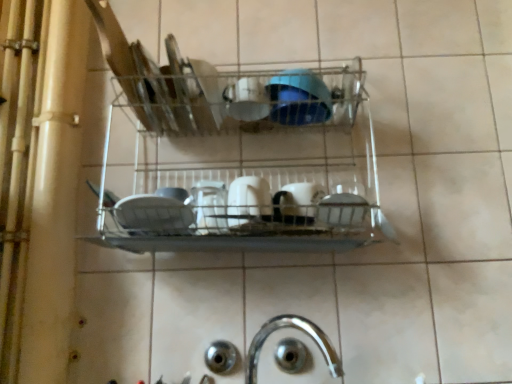
The width and height of the screenshot is (512, 384). Describe the element at coordinates (298, 329) in the screenshot. I see `silver metallic tap at lower center` at that location.

This screenshot has height=384, width=512. In order to click on white glossy mug at center, the fourth tableware positioned from the top in this screenshot , I will do `click(297, 203)`.

You are a GUI agent. You are given a task and a screenshot of the screen. Output one action in this format:
    pyautogui.click(x=<x>, y=<y>)
    Task: Click on the white glossy mug at center, arranged as the 2th tableware when ordered from the bottom
    The image size is (512, 384).
    Given the screenshot: What is the action you would take?
    pyautogui.click(x=248, y=201)

This screenshot has height=384, width=512. Identify the location of white glossy cup at upper center, which is the second tableware from top to bottom. (246, 100).

The image size is (512, 384). Find the location of `silver metallic tap at lower center`. silver metallic tap at lower center is located at coordinates (298, 329).

From the image's perspective, starting from the silver metallic tap at lower center, which tableware is the 2nd one above? Please provide its 2D coordinates.

[(248, 201)]

Is white glossy mug at center, placed as the third tableware when sorted from top to bottom, taller than silver metallic tap at lower center?

In fact, white glossy mug at center, placed as the third tableware when sorted from top to bottom, may be shorter than silver metallic tap at lower center.

Between white glossy mug at center, placed as the third tableware when sorted from top to bottom, and silver metallic tap at lower center, which one has larger size?

silver metallic tap at lower center is bigger.

In the scene shown: Are white glossy mug at center, arranged as the 2th tableware when ordered from the bottom, and silver metallic tap at lower center located far from each other?

That's not correct — white glossy mug at center, arranged as the 2th tableware when ordered from the bottom, is a little close to silver metallic tap at lower center.

From the image's perspective, is white glossy mug at center, arranged as the 2th tableware when ordered from the bottom, beneath blue glossy bowl at center, the first tableware when ordered from top to bottom?

Yes, from the image's perspective, white glossy mug at center, arranged as the 2th tableware when ordered from the bottom, is beneath blue glossy bowl at center, the first tableware when ordered from top to bottom.

From a real-world perspective, is white glossy mug at center, placed as the third tableware when sorted from top to bottom, physically located above or below blue glossy bowl at center, the first tableware when ordered from top to bottom?

white glossy mug at center, placed as the third tableware when sorted from top to bottom, is below blue glossy bowl at center, the first tableware when ordered from top to bottom.

Considering the positions of objects white glossy mug at center, placed as the third tableware when sorted from top to bottom, and blue glossy bowl at center, which appears as the fourth tableware when ordered from the bottom, in the image provided, who is behind, white glossy mug at center, placed as the third tableware when sorted from top to bottom, or blue glossy bowl at center, which appears as the fourth tableware when ordered from the bottom,?

blue glossy bowl at center, which appears as the fourth tableware when ordered from the bottom, is further from the camera.

Measure the distance from white glossy mug at center, arranged as the 2th tableware when ordered from the bottom, to blue glossy bowl at center, which appears as the fourth tableware when ordered from the bottom.

white glossy mug at center, arranged as the 2th tableware when ordered from the bottom, is 8.41 inches away from blue glossy bowl at center, which appears as the fourth tableware when ordered from the bottom.

Is silver metallic tap at lower center next to white glossy mug at center, placed as the third tableware when sorted from top to bottom?

They are not placed beside each other.

Based on the photo, from a real-world perspective, which is physically below, silver metallic tap at lower center or white glossy mug at center, placed as the third tableware when sorted from top to bottom?

silver metallic tap at lower center.

From the image's perspective, is silver metallic tap at lower center above or below white glossy mug at center, placed as the third tableware when sorted from top to bottom?

From the image's perspective, silver metallic tap at lower center appears below white glossy mug at center, placed as the third tableware when sorted from top to bottom.

Is the depth of silver metallic tap at lower center less than that of white glossy mug at center, placed as the third tableware when sorted from top to bottom?

Yes, silver metallic tap at lower center is closer to the camera.

Can you tell me how much blue glossy bowl at center, the first tableware when ordered from top to bottom, and white glossy mug at center, arranged as the 2th tableware when ordered from the bottom, differ in facing direction?

There is a 7.02-degree angle between the facing directions of blue glossy bowl at center, the first tableware when ordered from top to bottom, and white glossy mug at center, arranged as the 2th tableware when ordered from the bottom.

Who is bigger, blue glossy bowl at center, which appears as the fourth tableware when ordered from the bottom, or white glossy mug at center, placed as the third tableware when sorted from top to bottom?

With larger size is blue glossy bowl at center, which appears as the fourth tableware when ordered from the bottom.

Considering the positions of point (302, 79) and point (234, 215), is point (302, 79) closer or farther from the camera than point (234, 215)?

Point (302, 79) appears to be farther away from the viewer than point (234, 215).

How much distance is there between blue glossy bowl at center, the first tableware when ordered from top to bottom, and white glossy mug at center, arranged as the 2th tableware when ordered from the bottom?

8.41 inches.

Do you think white glossy cup at upper center, which is the second tableware from top to bottom, is within white glossy mug at center, arranged as the 2th tableware when ordered from the bottom, or outside of it?

white glossy cup at upper center, which is the second tableware from top to bottom, cannot be found inside white glossy mug at center, arranged as the 2th tableware when ordered from the bottom.

Can you confirm if white glossy cup at upper center, which is the second tableware from top to bottom, is thinner than white glossy mug at center, arranged as the 2th tableware when ordered from the bottom?

Yes, white glossy cup at upper center, which is the second tableware from top to bottom, is thinner than white glossy mug at center, arranged as the 2th tableware when ordered from the bottom.

Measure the distance from white glossy cup at upper center, acting as the third tableware starting from the bottom, to white glossy mug at center, arranged as the 2th tableware when ordered from the bottom.

They are 7.87 inches apart.

In the image, is blue glossy bowl at center, which appears as the fourth tableware when ordered from the bottom, on the left side or the right side of white glossy mug at center, the 1th tableware positioned from the bottom?

blue glossy bowl at center, which appears as the fourth tableware when ordered from the bottom, is to the right of white glossy mug at center, the 1th tableware positioned from the bottom.

From a real-world perspective, between blue glossy bowl at center, which appears as the fourth tableware when ordered from the bottom, and white glossy mug at center, the fourth tableware positioned from the top, who is vertically lower?

From a 3D spatial view, white glossy mug at center, the fourth tableware positioned from the top, is below.

Which of these two, blue glossy bowl at center, which appears as the fourth tableware when ordered from the bottom, or white glossy mug at center, the fourth tableware positioned from the top, is wider?

blue glossy bowl at center, which appears as the fourth tableware when ordered from the bottom.

Is blue glossy bowl at center, the first tableware when ordered from top to bottom, smaller than white glossy mug at center, the 1th tableware positioned from the bottom?

No.

From a real-world perspective, is white glossy mug at center, the 1th tableware positioned from the bottom, positioned above or below metallic wire rack at center?

From a real-world perspective, white glossy mug at center, the 1th tableware positioned from the bottom, is physically below metallic wire rack at center.

How many degrees apart are the facing directions of white glossy mug at center, the 1th tableware positioned from the bottom, and metallic wire rack at center?

They differ by 1.4 degrees in their facing directions.

Is point (320, 192) positioned after point (339, 195)?

Yes, it is.

You are a GUI agent. You are given a task and a screenshot of the screen. Output one action in this format:
    pyautogui.click(x=<x>, y=<y>)
    Task: Click on the tap that appears on the right of white glossy mug at center, arranged as the 2th tableware when ordered from the bottom
    The width and height of the screenshot is (512, 384).
    Given the screenshot: What is the action you would take?
    pyautogui.click(x=298, y=329)

From the white glossy mug at center, placed as the third tableware when sorted from top to bottom, count 3rd tablewares backward and point to it. Please provide its 2D coordinates.

[(298, 98)]

Estimate the real-world distances between objects in this image. Which object is further from metallic wire rack at center, blue glossy bowl at center, which appears as the fourth tableware when ordered from the bottom, or white glossy mug at center, placed as the third tableware when sorted from top to bottom?

Based on the image, white glossy mug at center, placed as the third tableware when sorted from top to bottom, appears to be further to metallic wire rack at center.

When comparing their distances from white glossy cup at upper center, acting as the third tableware starting from the bottom, does white glossy mug at center, placed as the third tableware when sorted from top to bottom, or metallic wire rack at center seem further?

metallic wire rack at center is further to white glossy cup at upper center, acting as the third tableware starting from the bottom.

Estimate the real-world distances between objects in this image. Which object is closer to blue glossy bowl at center, the first tableware when ordered from top to bottom, metallic wire rack at center or white glossy mug at center, placed as the third tableware when sorted from top to bottom?

metallic wire rack at center is positioned closer to the anchor blue glossy bowl at center, the first tableware when ordered from top to bottom.

Estimate the real-world distances between objects in this image. Which object is closer to white glossy cup at upper center, acting as the third tableware starting from the bottom, white glossy mug at center, the fourth tableware positioned from the top, or silver metallic tap at lower center?

Based on the image, white glossy mug at center, the fourth tableware positioned from the top, appears to be nearer to white glossy cup at upper center, acting as the third tableware starting from the bottom.

Looking at the image, which one is located closer to blue glossy bowl at center, the first tableware when ordered from top to bottom, metallic wire rack at center or white glossy cup at upper center, which is the second tableware from top to bottom?

white glossy cup at upper center, which is the second tableware from top to bottom, is closer to blue glossy bowl at center, the first tableware when ordered from top to bottom.

Looking at the image, which one is located closer to white glossy mug at center, the 1th tableware positioned from the bottom, white glossy cup at upper center, which is the second tableware from top to bottom, or silver metallic tap at lower center?

white glossy cup at upper center, which is the second tableware from top to bottom.

When comparing their distances from white glossy mug at center, the 1th tableware positioned from the bottom, does metallic wire rack at center or silver metallic tap at lower center seem further?

silver metallic tap at lower center is further to white glossy mug at center, the 1th tableware positioned from the bottom.

Which object lies nearer to the anchor point silver metallic tap at lower center, white glossy mug at center, placed as the third tableware when sorted from top to bottom, or metallic wire rack at center?

white glossy mug at center, placed as the third tableware when sorted from top to bottom, lies closer to silver metallic tap at lower center than the other object.

Where is `shelf between white glossy cup at upper center, which is the second tableware from top to bottom, and white glossy mug at center, arranged as the 2th tableware when ordered from the bottom, vertically`? shelf between white glossy cup at upper center, which is the second tableware from top to bottom, and white glossy mug at center, arranged as the 2th tableware when ordered from the bottom, vertically is located at coordinates pyautogui.click(x=246, y=165).

I want to click on shelf between white glossy cup at upper center, which is the second tableware from top to bottom, and white glossy mug at center, the 1th tableware positioned from the bottom, vertically, so click(246, 165).

This screenshot has width=512, height=384. I want to click on tableware between white glossy cup at upper center, which is the second tableware from top to bottom, and white glossy mug at center, the 1th tableware positioned from the bottom, from top to bottom, so click(248, 201).

You are a GUI agent. You are given a task and a screenshot of the screen. Output one action in this format:
    pyautogui.click(x=<x>, y=<y>)
    Task: Click on the tableware that lies between white glossy mug at center, placed as the third tableware when sorted from top to bottom, and silver metallic tap at lower center from top to bottom
    Image resolution: width=512 pixels, height=384 pixels.
    Given the screenshot: What is the action you would take?
    pyautogui.click(x=297, y=203)